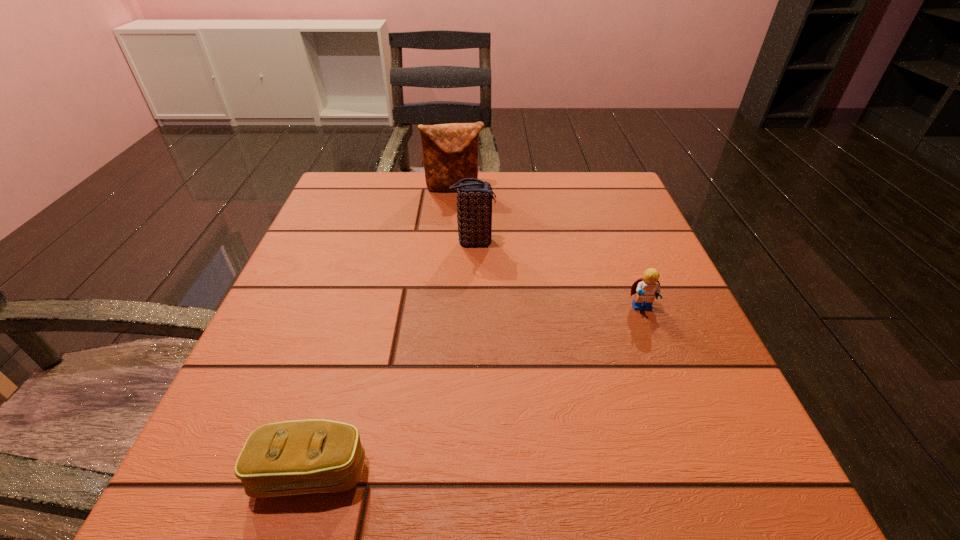
At what (x,y) coordinates should I click in order to perform the action: click on object present at the near edge. Please return your answer as a coordinate pair (x, y). The image size is (960, 540). Looking at the image, I should click on (295, 457).

Find the location of `object that is at the left edge`. object that is at the left edge is located at coordinates (295, 457).

Find the location of a particular element. This screenshot has height=540, width=960. object that is at the right edge is located at coordinates (646, 289).

This screenshot has height=540, width=960. Find the location of `object that is positioned at the near left corner`. object that is positioned at the near left corner is located at coordinates (295, 457).

Find the location of `vacant space at the far edge of the desktop`. vacant space at the far edge of the desktop is located at coordinates (424, 206).

This screenshot has width=960, height=540. What are the coordinates of `vacant space at the near edge of the desktop` in the screenshot? It's located at (532, 502).

You are a GUI agent. You are given a task and a screenshot of the screen. Output one action in this format:
    pyautogui.click(x=<x>, y=<y>)
    Task: Click on the vacant area at the left edge
    The height and width of the screenshot is (540, 960).
    Given the screenshot: What is the action you would take?
    pyautogui.click(x=353, y=315)

This screenshot has width=960, height=540. I want to click on vacant space at the right edge, so click(716, 421).

This screenshot has width=960, height=540. Identify the location of vacant space at the far left corner. (392, 172).

You are a GUI agent. You are given a task and a screenshot of the screen. Output one action in this format:
    pyautogui.click(x=<x>, y=<y>)
    Task: Click on the blank space at the far right corner of the desktop
    
    Given the screenshot: What is the action you would take?
    pyautogui.click(x=575, y=207)